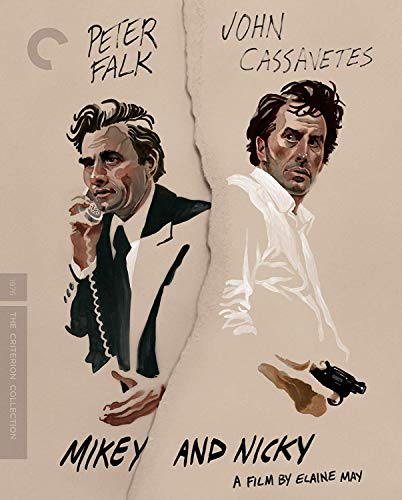
Where is `rotary phone receiver`? Image resolution: width=402 pixels, height=500 pixels. rotary phone receiver is located at coordinates (90, 220).